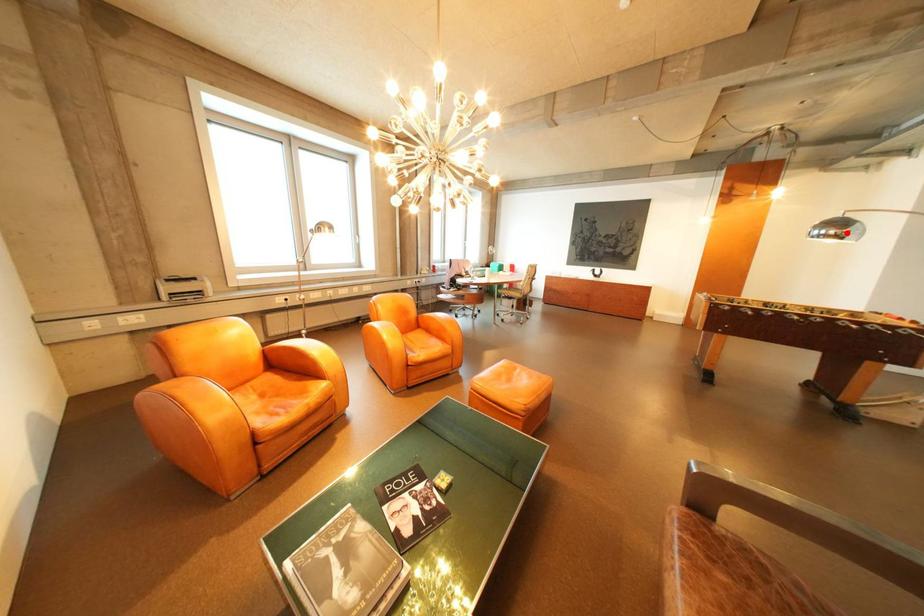
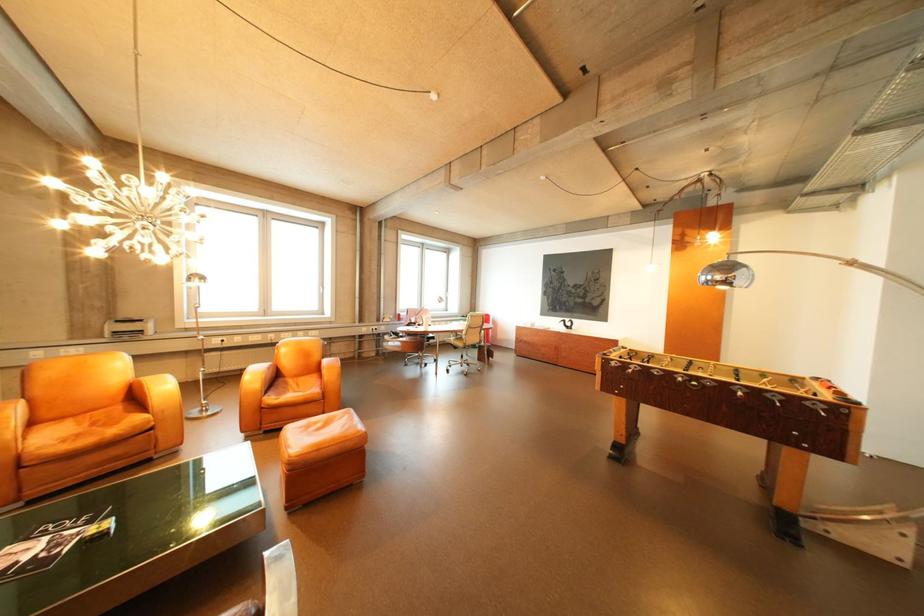
Locate, in the second image, the point that corresponds to the highlighted location in the first image.

(732, 278)